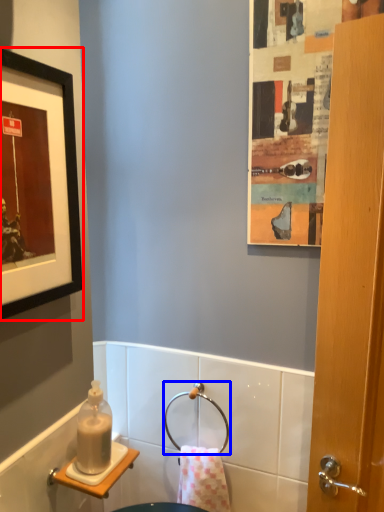
Question: Which point is closer to the camera, picture frame (highlighted by a red box) or towel bar (highlighted by a blue box)?

Choices:
 (A) picture frame
 (B) towel bar

Answer: (A)